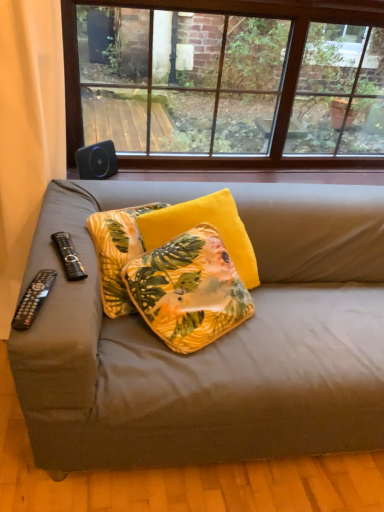
Question: Is black plastic remote at left, placed as the second remote control when sorted from bottom to top, positioned beyond the bounds of yellow velvet pillow at center, positioned as the 1th pillow in left-to-right order?

Choices:
 (A) yes
 (B) no

Answer: (A)

Question: From the image's perspective, is black plastic remote at left, placed as the second remote control when sorted from bottom to top, located beneath yellow velvet pillow at center, the third pillow from the right?

Choices:
 (A) no
 (B) yes

Answer: (A)

Question: Can you confirm if black plastic remote at left, which ranks as the second remote control in front-to-back order, is bigger than yellow velvet pillow at center, the third pillow from the right?

Choices:
 (A) yes
 (B) no

Answer: (B)

Question: Is black plastic remote at left, placed as the second remote control when sorted from bottom to top, wider than yellow velvet pillow at center, positioned as the 1th pillow in left-to-right order?

Choices:
 (A) yes
 (B) no

Answer: (A)

Question: Does black plastic remote at left, placed as the second remote control when sorted from bottom to top, appear on the left side of yellow velvet pillow at center, positioned as the 1th pillow in left-to-right order?

Choices:
 (A) no
 (B) yes

Answer: (B)

Question: From a real-world perspective, relative to black plastic remote at lower left, the 1th remote control when ordered from bottom to top, is yellow velvet pillow at center, the 3th pillow viewed from the left, vertically above or below?

Choices:
 (A) above
 (B) below

Answer: (B)

Question: Considering the relative positions of yellow velvet pillow at center, the 1th pillow when ordered from right to left, and black plastic remote at lower left, the 1th remote control when ordered from bottom to top, in the image provided, is yellow velvet pillow at center, the 1th pillow when ordered from right to left, to the left or to the right of black plastic remote at lower left, the 1th remote control when ordered from bottom to top,?

Choices:
 (A) left
 (B) right

Answer: (B)

Question: In terms of width, does yellow velvet pillow at center, the 1th pillow when ordered from right to left, look wider or thinner when compared to black plastic remote at lower left, marked as the second remote control in a back-to-front arrangement?

Choices:
 (A) thin
 (B) wide

Answer: (B)

Question: Do you think yellow velvet pillow at center, the 3th pillow viewed from the left, is within black plastic remote at lower left, marked as the first remote control in a front-to-back arrangement, or outside of it?

Choices:
 (A) inside
 (B) outside

Answer: (B)

Question: Is matte gray couch at center in front of or behind yellow velvet pillow at center, the third pillow from the right, in the image?

Choices:
 (A) front
 (B) behind

Answer: (A)

Question: From a real-world perspective, is matte gray couch at center above or below yellow velvet pillow at center, positioned as the 1th pillow in left-to-right order?

Choices:
 (A) below
 (B) above

Answer: (A)

Question: Considering the positions of matte gray couch at center and yellow velvet pillow at center, the third pillow from the right, in the image, is matte gray couch at center bigger or smaller than yellow velvet pillow at center, the third pillow from the right,?

Choices:
 (A) big
 (B) small

Answer: (A)

Question: Is matte gray couch at center inside or outside of yellow velvet pillow at center, the third pillow from the right?

Choices:
 (A) inside
 (B) outside

Answer: (B)

Question: From the image's perspective, is black fabric remote at left above or below yellow floral pillow at center, positioned as the 2th pillow in right-to-left order?

Choices:
 (A) above
 (B) below

Answer: (A)

Question: Is black fabric remote at left spatially inside yellow floral pillow at center, the 2th pillow in the left-to-right sequence, or outside of it?

Choices:
 (A) inside
 (B) outside

Answer: (B)